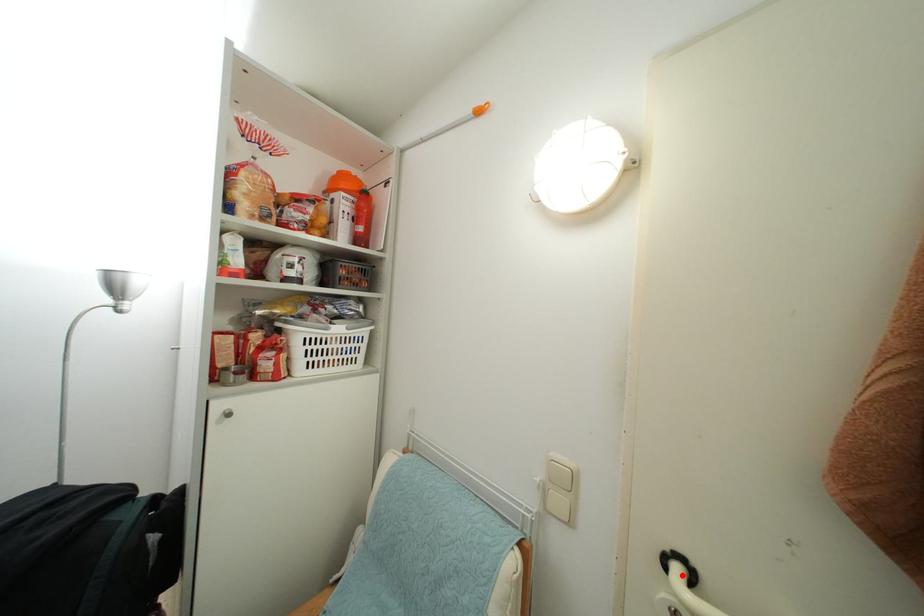
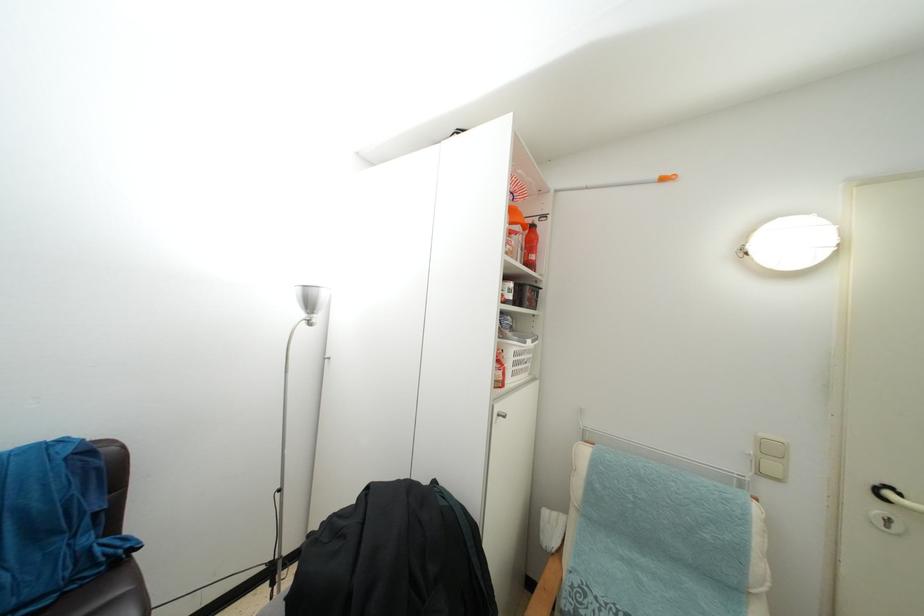
Question: A red point is marked in image1. In image2, is the corresponding 3D point closer to the camera or farther? Reply with the corresponding letter.

Choices:
 (A) The corresponding 3D point is closer.
 (B) The corresponding 3D point is farther.

Answer: (A)